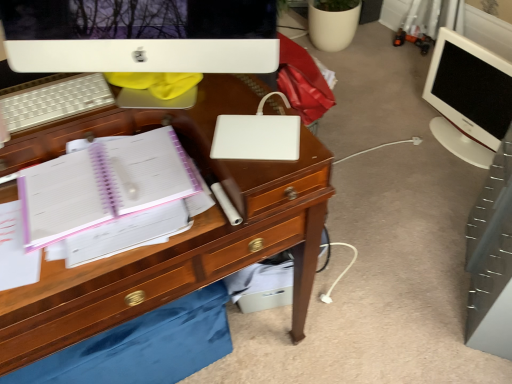
Locate an element on the screen. This screenshot has width=512, height=384. white matte laptop at center is located at coordinates (256, 137).

Does white glossy computer monitor at upper center, marked as the 1th computer monitor in a front-to-back arrangement, contain white matte laptop at center?

No, white matte laptop at center is located outside of white glossy computer monitor at upper center, marked as the 1th computer monitor in a front-to-back arrangement.

From a real-world perspective, between white glossy computer monitor at upper center, which appears as the 2th computer monitor when viewed from the back, and white matte laptop at center, who is vertically higher?

white glossy computer monitor at upper center, which appears as the 2th computer monitor when viewed from the back, is physically above.

Considering the points (24, 25) and (287, 116), which point is behind, point (24, 25) or point (287, 116)?

The point (287, 116) is more distant.

The image size is (512, 384). Find the location of `notebook in front of the white glossy monitor at right, positioned as the first computer monitor in back-to-front order`. notebook in front of the white glossy monitor at right, positioned as the first computer monitor in back-to-front order is located at coordinates (103, 185).

Can you confirm if pink glossy notebook at left is wider than white glossy monitor at right, the 2th computer monitor in the left-to-right sequence?

Yes, pink glossy notebook at left is wider than white glossy monitor at right, the 2th computer monitor in the left-to-right sequence.

Can we say pink glossy notebook at left lies outside white glossy monitor at right, positioned as the first computer monitor in back-to-front order?

Yes, pink glossy notebook at left is located beyond the bounds of white glossy monitor at right, positioned as the first computer monitor in back-to-front order.

Considering the points (144, 170) and (213, 146), which point is in front, point (144, 170) or point (213, 146)?

The point (213, 146) is in front.

From the image's perspective, is pink glossy notebook at left above or below white matte laptop at center?

pink glossy notebook at left is below white matte laptop at center.

In the image, is pink glossy notebook at left on the left side or the right side of white matte laptop at center?

Clearly, pink glossy notebook at left is on the left of white matte laptop at center in the image.

Would you say pink glossy notebook at left is outside white matte laptop at center?

pink glossy notebook at left is positioned outside white matte laptop at center.

Between white matte laptop at center and white plastic keyboard at upper left, which one appears on the right side from the viewer's perspective?

Positioned to the right is white matte laptop at center.

Considering the positions of objects white matte laptop at center and white plastic keyboard at upper left in the image provided, who is behind, white matte laptop at center or white plastic keyboard at upper left?

white plastic keyboard at upper left is more distant.

Would you say white matte laptop at center is outside white plastic keyboard at upper left?

Indeed, white matte laptop at center is completely outside white plastic keyboard at upper left.

Is white matte laptop at center oriented towards white plastic keyboard at upper left?

No, white matte laptop at center is not turned towards white plastic keyboard at upper left.

From a real-world perspective, who is located higher, wooden drawer at lower center or white glossy monitor at right, the first computer monitor viewed from the right?

white glossy monitor at right, the first computer monitor viewed from the right, is physically above.

Is white glossy monitor at right, the 2th computer monitor in the left-to-right sequence, surrounded by wooden drawer at lower center?

That's incorrect, white glossy monitor at right, the 2th computer monitor in the left-to-right sequence, is not inside wooden drawer at lower center.

Can you confirm if wooden drawer at lower center is positioned to the left of pink glossy notebook at left?

Correct, you'll find wooden drawer at lower center to the left of pink glossy notebook at left.

Is wooden drawer at lower center positioned beyond the bounds of pink glossy notebook at left?

Absolutely, wooden drawer at lower center is external to pink glossy notebook at left.

Is pink glossy notebook at left at the back of wooden drawer at lower center?

No, wooden drawer at lower center's orientation is not away from pink glossy notebook at left.

Is wooden drawer at lower center far away from pink glossy notebook at left?

No, wooden drawer at lower center is in close proximity to pink glossy notebook at left.

Considering the relative sizes of white plastic keyboard at upper left and white glossy monitor at right, the second computer monitor positioned from the front, in the image provided, is white plastic keyboard at upper left taller than white glossy monitor at right, the second computer monitor positioned from the front,?

No, white plastic keyboard at upper left is not taller than white glossy monitor at right, the second computer monitor positioned from the front.

Does white plastic keyboard at upper left turn towards white glossy monitor at right, the first computer monitor viewed from the right?

No.

From the image's perspective, which one is positioned lower, white plastic keyboard at upper left or white glossy monitor at right, positioned as the first computer monitor in back-to-front order?

white plastic keyboard at upper left is shown below in the image.

Based on the photo, considering the sizes of objects white plastic keyboard at upper left and white glossy monitor at right, positioned as the first computer monitor in back-to-front order, in the image provided, who is smaller, white plastic keyboard at upper left or white glossy monitor at right, positioned as the first computer monitor in back-to-front order,?

white plastic keyboard at upper left.

Find the location of a particular element. This screenshot has width=512, height=384. computer monitor that is in front of the white matte laptop at center is located at coordinates (141, 35).

You are a GUI agent. You are given a task and a screenshot of the screen. Output one action in this format:
    pyautogui.click(x=<x>, y=<y>)
    Task: Click on the computer monitor that is the 2nd one when counting upward from the pink glossy notebook at left (from the image's perspective)
    The width and height of the screenshot is (512, 384).
    Given the screenshot: What is the action you would take?
    pyautogui.click(x=468, y=98)

Consider the image. When comparing their distances from white glossy computer monitor at upper center, marked as the 1th computer monitor in a front-to-back arrangement, does pink glossy notebook at left or white glossy monitor at right, the first computer monitor viewed from the right, seem further?

The object further to white glossy computer monitor at upper center, marked as the 1th computer monitor in a front-to-back arrangement, is white glossy monitor at right, the first computer monitor viewed from the right.

Based on their spatial positions, is white glossy computer monitor at upper center, which ranks as the 1th computer monitor in left-to-right order, or white matte laptop at center further from pink glossy notebook at left?

Among the two, white glossy computer monitor at upper center, which ranks as the 1th computer monitor in left-to-right order, is located further to pink glossy notebook at left.

Based on their spatial positions, is wooden drawer at lower center or white plastic keyboard at upper left closer to white matte laptop at center?

Based on the image, wooden drawer at lower center appears to be nearer to white matte laptop at center.

Considering their positions, is white glossy monitor at right, the 2th computer monitor in the left-to-right sequence, positioned closer to white matte laptop at center than wooden drawer at lower center?

The object closer to white matte laptop at center is wooden drawer at lower center.

In the scene shown: From the image, which object appears to be nearer to white glossy monitor at right, the first computer monitor viewed from the right, wooden drawer at lower center or white glossy computer monitor at upper center, which ranks as the 1th computer monitor in left-to-right order?

white glossy computer monitor at upper center, which ranks as the 1th computer monitor in left-to-right order, lies closer to white glossy monitor at right, the first computer monitor viewed from the right, than the other object.

Estimate the real-world distances between objects in this image. Which object is further from white plastic keyboard at upper left, pink glossy notebook at left or wooden drawer at lower center?

Among the two, wooden drawer at lower center is located further to white plastic keyboard at upper left.

Estimate the real-world distances between objects in this image. Which object is further from wooden drawer at lower center, white plastic keyboard at upper left or pink glossy notebook at left?

white plastic keyboard at upper left lies further to wooden drawer at lower center than the other object.

Based on their spatial positions, is wooden drawer at lower center or white glossy monitor at right, the second computer monitor positioned from the front, further from white glossy computer monitor at upper center, which appears as the 2th computer monitor when viewed from the back?

white glossy monitor at right, the second computer monitor positioned from the front, is further to white glossy computer monitor at upper center, which appears as the 2th computer monitor when viewed from the back.

You are a GUI agent. You are given a task and a screenshot of the screen. Output one action in this format:
    pyautogui.click(x=<x>, y=<y>)
    Task: Click on the laptop between white glossy computer monitor at upper center, marked as the 1th computer monitor in a front-to-back arrangement, and pink glossy notebook at left from top to bottom
    
    Given the screenshot: What is the action you would take?
    pyautogui.click(x=256, y=137)

The height and width of the screenshot is (384, 512). Find the location of `laptop between pink glossy notebook at left and white glossy monitor at right, the second computer monitor positioned from the front, in the horizontal direction`. laptop between pink glossy notebook at left and white glossy monitor at right, the second computer monitor positioned from the front, in the horizontal direction is located at coordinates (256, 137).

The image size is (512, 384). Find the location of `laptop between white plastic keyboard at upper left and white glossy monitor at right, the first computer monitor viewed from the right, from left to right`. laptop between white plastic keyboard at upper left and white glossy monitor at right, the first computer monitor viewed from the right, from left to right is located at coordinates (256, 137).

Image resolution: width=512 pixels, height=384 pixels. I want to click on computer monitor between white plastic keyboard at upper left and white matte laptop at center from left to right, so click(141, 35).